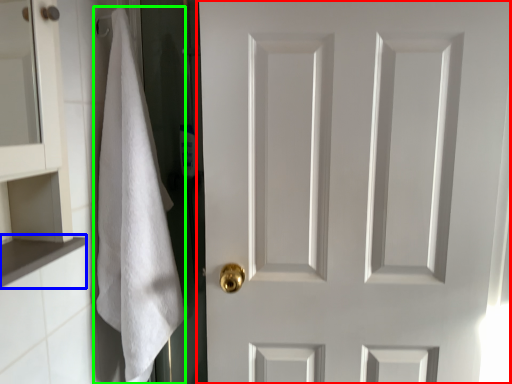
Question: Considering the real-world distances, which object is closest to door (highlighted by a red box)? cabinet (highlighted by a blue box) or bath towel (highlighted by a green box).

Choices:
 (A) cabinet
 (B) bath towel

Answer: (B)